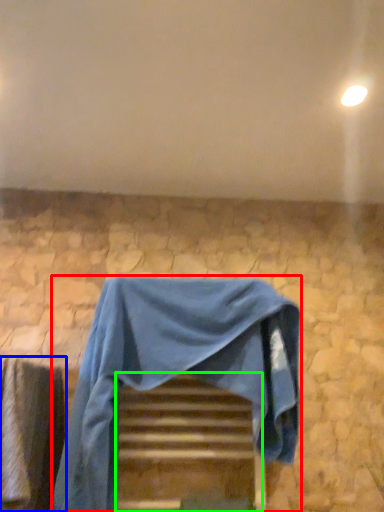
Question: Based on their relative distances, which object is farther from furniture (highlighted by a red box)? Choose from curtain (highlighted by a blue box) and stairwell (highlighted by a green box).

Choices:
 (A) curtain
 (B) stairwell

Answer: (A)